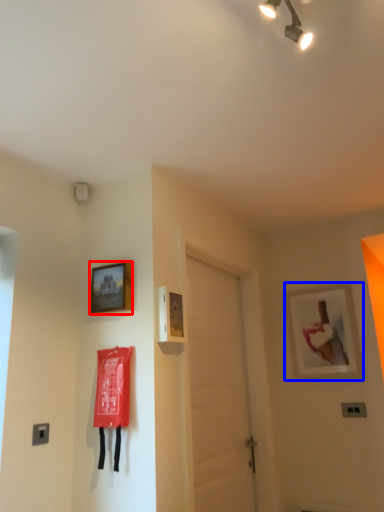
Question: Which object appears farthest to the camera in this image, picture frame (highlighted by a red box) or picture frame (highlighted by a blue box)?

Choices:
 (A) picture frame
 (B) picture frame

Answer: (B)